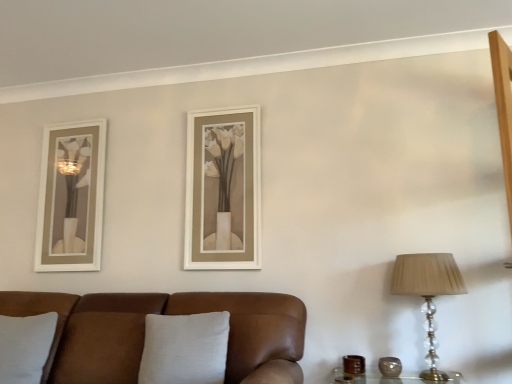
Question: Can you confirm if brown leather couch at lower left is smaller than gray fabric pillow at lower left, the second pillow viewed from the right?

Choices:
 (A) yes
 (B) no

Answer: (B)

Question: Does brown leather couch at lower left turn towards gray fabric pillow at lower left, the second pillow viewed from the right?

Choices:
 (A) yes
 (B) no

Answer: (A)

Question: Does brown leather couch at lower left lie in front of gray fabric pillow at lower left, the second pillow viewed from the right?

Choices:
 (A) no
 (B) yes

Answer: (B)

Question: Is brown leather couch at lower left shorter than gray fabric pillow at lower left, marked as the 1th pillow in a left-to-right arrangement?

Choices:
 (A) no
 (B) yes

Answer: (A)

Question: Is brown leather couch at lower left wider than gray fabric pillow at lower left, the second pillow viewed from the right?

Choices:
 (A) no
 (B) yes

Answer: (B)

Question: Considering the relative positions of brown leather couch at lower left and gray fabric pillow at lower left, the second pillow viewed from the right, in the image provided, is brown leather couch at lower left to the left of gray fabric pillow at lower left, the second pillow viewed from the right, from the viewer's perspective?

Choices:
 (A) no
 (B) yes

Answer: (A)

Question: Does brown textured vase at right, marked as the first candle holder in a right-to-left arrangement, have a greater height compared to brown leather couch at lower left?

Choices:
 (A) yes
 (B) no

Answer: (B)

Question: Does brown textured vase at right, marked as the first candle holder in a right-to-left arrangement, have a lesser height compared to brown leather couch at lower left?

Choices:
 (A) yes
 (B) no

Answer: (A)

Question: Is brown textured vase at right, marked as the first candle holder in a right-to-left arrangement, looking in the opposite direction of brown leather couch at lower left?

Choices:
 (A) no
 (B) yes

Answer: (A)

Question: From the image's perspective, is brown textured vase at right, marked as the first candle holder in a right-to-left arrangement, below brown leather couch at lower left?

Choices:
 (A) no
 (B) yes

Answer: (B)

Question: From a real-world perspective, is brown textured vase at right, the second candle holder in the left-to-right sequence, located beneath brown leather couch at lower left?

Choices:
 (A) no
 (B) yes

Answer: (B)

Question: Considering the relative positions of brown textured vase at right, marked as the first candle holder in a right-to-left arrangement, and brown leather couch at lower left in the image provided, is brown textured vase at right, marked as the first candle holder in a right-to-left arrangement, to the right of brown leather couch at lower left from the viewer's perspective?

Choices:
 (A) yes
 (B) no

Answer: (A)

Question: Is gray fabric pillow at lower left, the second pillow viewed from the right, not within brown leather couch at lower left?

Choices:
 (A) no
 (B) yes

Answer: (A)